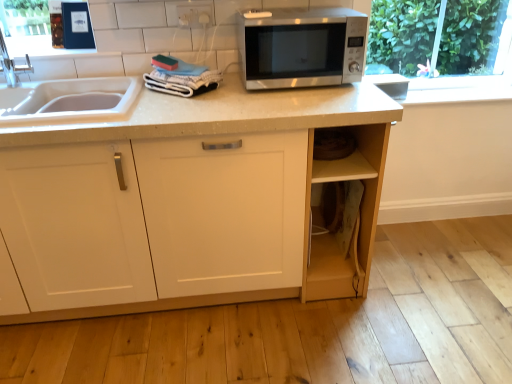
Locate an element on the screen. This screenshot has height=384, width=512. blue matte book at upper left is located at coordinates (30, 27).

What do you see at coordinates (187, 202) in the screenshot? The height and width of the screenshot is (384, 512). I see `matte white cabinet at center` at bounding box center [187, 202].

The image size is (512, 384). Identify the location of blue matte book at upper left. (30, 27).

Is blue matte book at upper left bigger than matte white cabinet at center?

No, blue matte book at upper left is not bigger than matte white cabinet at center.

Between blue matte book at upper left and matte white cabinet at center, which one has larger width?

Wider between the two is matte white cabinet at center.

From the image's perspective, would you say blue matte book at upper left is positioned over matte white cabinet at center?

Yes, from the image's perspective, blue matte book at upper left is over matte white cabinet at center.

Is satin silver microwave at center aimed at white plastic electric outlet at upper center?

No, satin silver microwave at center is not turned towards white plastic electric outlet at upper center.

Between point (338, 10) and point (204, 17), which one is positioned behind?

The point (338, 10) is farther.

Is satin silver microwave at center next to white plastic electric outlet at upper center?

No, satin silver microwave at center is not next to white plastic electric outlet at upper center.

In the image, there is a white plastic electric outlet at upper center. Where is `microwave oven below it (from a real-world perspective)`? microwave oven below it (from a real-world perspective) is located at coordinates (302, 48).

At what (x,y) coordinates should I click in order to perform the action: click on microwave oven lying on the right of blue matte book at upper left. Please return your answer as a coordinate pair (x, y). Looking at the image, I should click on (302, 48).

Which is in front, blue matte book at upper left or satin silver microwave at center?

satin silver microwave at center is more forward.

Which is closer to the camera, (14,10) or (334,50)?

Positioned in front is point (334,50).

Does blue matte book at upper left touch satin silver microwave at center?

There is a gap between blue matte book at upper left and satin silver microwave at center.

Is white plastic electric outlet at upper center next to matte white cabinet at center and touching it?

No, white plastic electric outlet at upper center is not touching matte white cabinet at center.

From the image's perspective, is white plastic electric outlet at upper center positioned above or below matte white cabinet at center?

white plastic electric outlet at upper center is above matte white cabinet at center.

Which object is positioned more to the left, white plastic electric outlet at upper center or matte white cabinet at center?

matte white cabinet at center is more to the left.

Which of these two, white plastic electric outlet at upper center or blue matte book at upper left, stands shorter?

white plastic electric outlet at upper center.

Could you tell me if white plastic electric outlet at upper center is facing blue matte book at upper left?

No, white plastic electric outlet at upper center does not turn towards blue matte book at upper left.

Which is correct: white plastic electric outlet at upper center is inside blue matte book at upper left, or outside of it?

white plastic electric outlet at upper center cannot be found inside blue matte book at upper left.

Does white plastic electric outlet at upper center contain satin silver microwave at center?

No, satin silver microwave at center is located outside of white plastic electric outlet at upper center.

Looking at this image, considering the relative sizes of white plastic electric outlet at upper center and satin silver microwave at center in the image provided, is white plastic electric outlet at upper center smaller than satin silver microwave at center?

Correct, white plastic electric outlet at upper center occupies less space than satin silver microwave at center.

Does white plastic electric outlet at upper center have a lesser height compared to satin silver microwave at center?

Correct, white plastic electric outlet at upper center is not as tall as satin silver microwave at center.

Identify the location of electric outlet on the left side of satin silver microwave at center. Image resolution: width=512 pixels, height=384 pixels. (195, 14).

From the image's perspective, is matte white cabinet at center on top of blue matte book at upper left?

No.

From a real-world perspective, is matte white cabinet at center physically above blue matte book at upper left?

Actually, matte white cabinet at center is physically below blue matte book at upper left in the real world.

Is matte white cabinet at center to the left or to the right of blue matte book at upper left in the image?

matte white cabinet at center is positioned on blue matte book at upper left's right side.

Locate an element on the screen. cabinetry below the blue matte book at upper left (from the image's perspective) is located at coordinates (187, 202).

Locate an element on the screen. The width and height of the screenshot is (512, 384). electric outlet behind the satin silver microwave at center is located at coordinates (195, 14).

When comparing their distances from matte white cabinet at center, does white plastic electric outlet at upper center or satin silver microwave at center seem closer?

Based on the image, satin silver microwave at center appears to be nearer to matte white cabinet at center.

Which object lies further to the anchor point satin silver microwave at center, blue matte book at upper left or white plastic electric outlet at upper center?

Among the two, blue matte book at upper left is located further to satin silver microwave at center.

Estimate the real-world distances between objects in this image. Which object is closer to white plastic electric outlet at upper center, blue matte book at upper left or satin silver microwave at center?

Among the two, satin silver microwave at center is located nearer to white plastic electric outlet at upper center.

Which object lies further to the anchor point blue matte book at upper left, white plastic electric outlet at upper center or satin silver microwave at center?

satin silver microwave at center.

Estimate the real-world distances between objects in this image. Which object is closer to white plastic electric outlet at upper center, matte white cabinet at center or satin silver microwave at center?

satin silver microwave at center is positioned closer to the anchor white plastic electric outlet at upper center.

When comparing their distances from matte white cabinet at center, does blue matte book at upper left or satin silver microwave at center seem closer?

satin silver microwave at center is closer to matte white cabinet at center.

Looking at the image, which one is located further to matte white cabinet at center, white plastic electric outlet at upper center or blue matte book at upper left?

Among the two, blue matte book at upper left is located further to matte white cabinet at center.

Consider the image. When comparing their distances from blue matte book at upper left, does matte white cabinet at center or white plastic electric outlet at upper center seem closer?

white plastic electric outlet at upper center is positioned closer to the anchor blue matte book at upper left.

You are a GUI agent. You are given a task and a screenshot of the screen. Output one action in this format:
    pyautogui.click(x=<x>, y=<y>)
    Task: Click on the cabinetry between blue matte book at upper left and satin silver microwave at center in the horizontal direction
    
    Given the screenshot: What is the action you would take?
    pyautogui.click(x=187, y=202)

At what (x,y) coordinates should I click in order to perform the action: click on microwave oven between white plastic electric outlet at upper center and matte white cabinet at center from top to bottom. Please return your answer as a coordinate pair (x, y). This screenshot has width=512, height=384. Looking at the image, I should click on (302, 48).

At what (x,y) coordinates should I click in order to perform the action: click on electric outlet between blue matte book at upper left and matte white cabinet at center from top to bottom. Please return your answer as a coordinate pair (x, y). The width and height of the screenshot is (512, 384). Looking at the image, I should click on (195, 14).

Image resolution: width=512 pixels, height=384 pixels. Find the location of `electric outlet between blue matte book at upper left and satin silver microwave at center in the horizontal direction`. electric outlet between blue matte book at upper left and satin silver microwave at center in the horizontal direction is located at coordinates (195, 14).